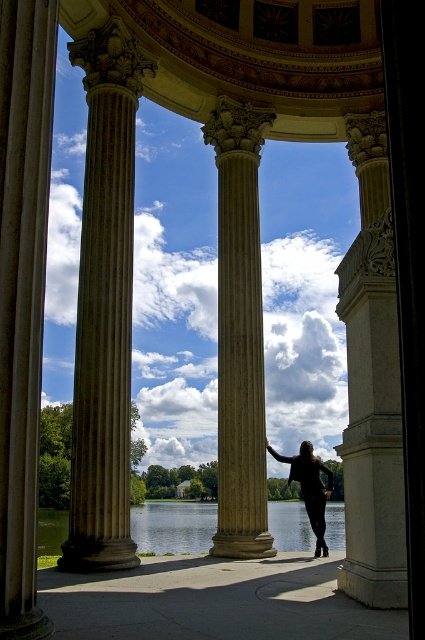
You are standing in front of the classical structure and want to take a photo of the marble column at center and the black matte dress at center. Which object should you position to the right side of your camera frame to include both in the shot?

Since the marble column at center is to the left of the black matte dress at center, you should position the black matte dress at center on the right side of your camera frame to include both in the shot.

You are a tour guide leading a group through this classical pavilion. You want to ensure that visitors maintain a safe distance of at least 2 meters from the historical marble column at center. A visitor is standing at the position of the black matte dress at center. Is the visitor currently within the required safety zone?

The marble column at center is 5.76 meters from the black matte dress at center. Since the required safety distance is 2 meters, the visitor is well within the safe zone as they are more than 2 meters away.

You are standing at the center of the classical structure and see the point marked at coordinates [104,305]. Which object is located at that point?

The point at coordinates [104,305] corresponds to the marble column at left.